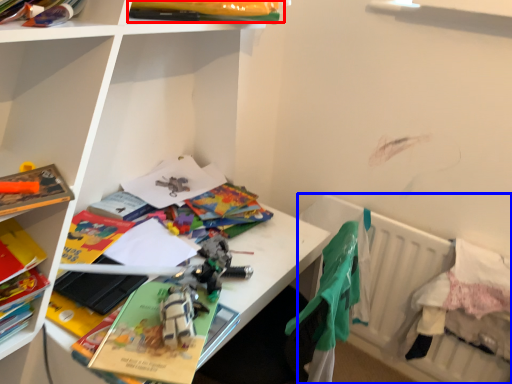
Question: Which object appears closest to the camera in this image, book (highlighted by a red box) or bed (highlighted by a blue box)?

Choices:
 (A) book
 (B) bed

Answer: (A)